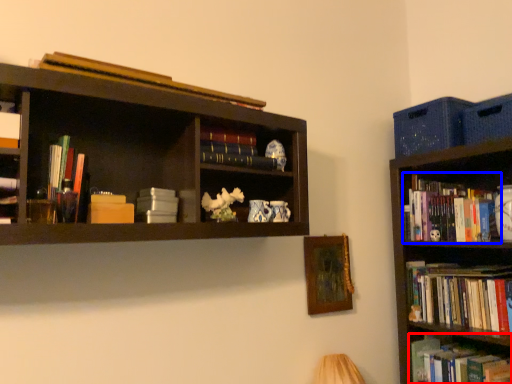
Question: Which point is closer to the camera, book (highlighted by a red box) or book (highlighted by a blue box)?

Choices:
 (A) book
 (B) book

Answer: (A)